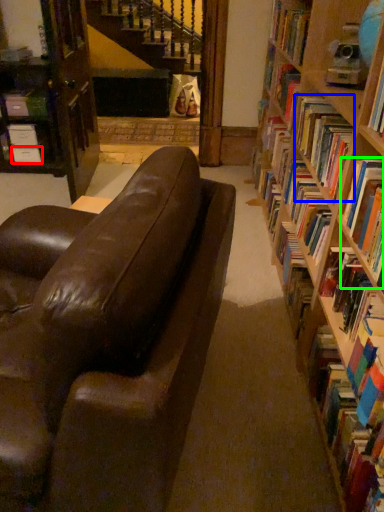
Question: Which object is the farthest from paperback book (highlighted by a red box)? Choose among these: book (highlighted by a blue box) or book (highlighted by a green box).

Choices:
 (A) book
 (B) book

Answer: (B)